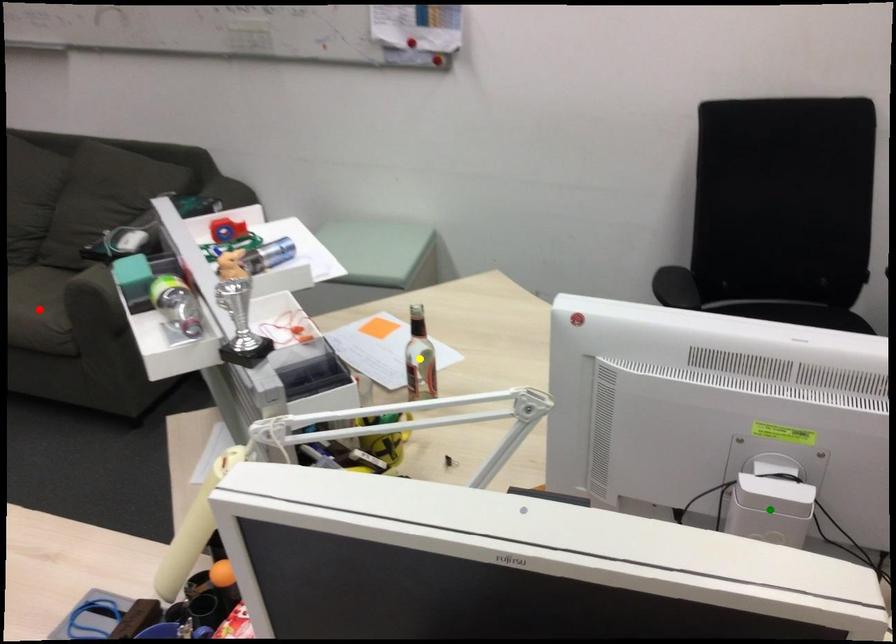
Order these from nearest to farthest:
- yellow point
- red point
- green point

red point
yellow point
green point